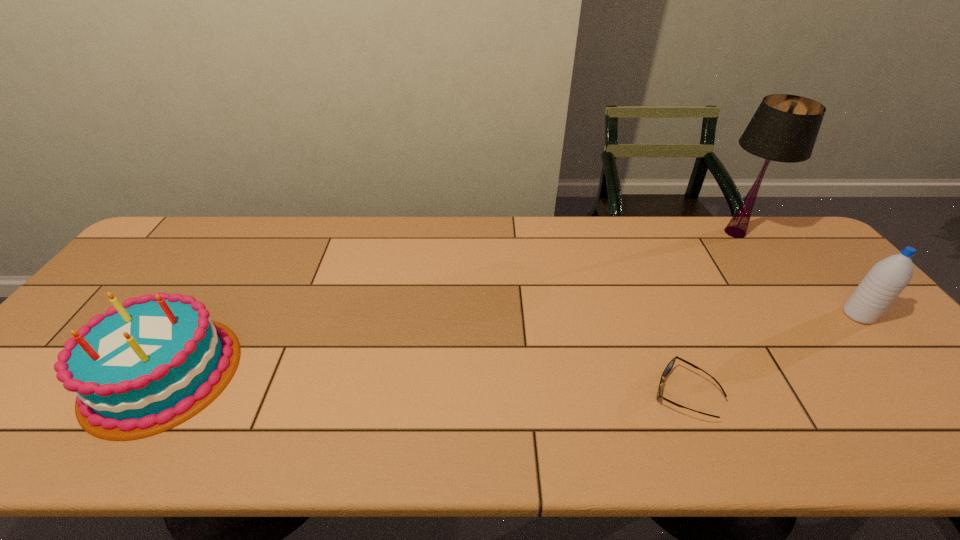
Locate an element on the screen. The height and width of the screenshot is (540, 960). the tallest object is located at coordinates (784, 128).

You are a GUI agent. You are given a task and a screenshot of the screen. Output one action in this format:
    pyautogui.click(x=<x>, y=<y>)
    Task: Click on the third object from left to right
    The height and width of the screenshot is (540, 960).
    Given the screenshot: What is the action you would take?
    pyautogui.click(x=784, y=128)

In order to click on the rightmost object in this screenshot , I will do `click(887, 278)`.

At what (x,y) coordinates should I click in order to perform the action: click on birthday cake. Please return your answer as a coordinate pair (x, y). Looking at the image, I should click on (147, 365).

Locate an element on the screen. sunglasses is located at coordinates (668, 368).

The height and width of the screenshot is (540, 960). What are the coordinates of `the shortest object` in the screenshot? It's located at (668, 368).

Where is `free location located on the front-facing side of the tallest object`? The width and height of the screenshot is (960, 540). free location located on the front-facing side of the tallest object is located at coordinates (791, 309).

Locate an element on the screen. Image resolution: width=960 pixels, height=540 pixels. free space located on the front of the rightmost object is located at coordinates (922, 388).

Image resolution: width=960 pixels, height=540 pixels. I want to click on vacant space located 0.360m on the right of the birthday cake, so click(391, 373).

Locate an element on the screen. free space located 0.160m at the front of the sunglasses showing the lenses is located at coordinates (580, 393).